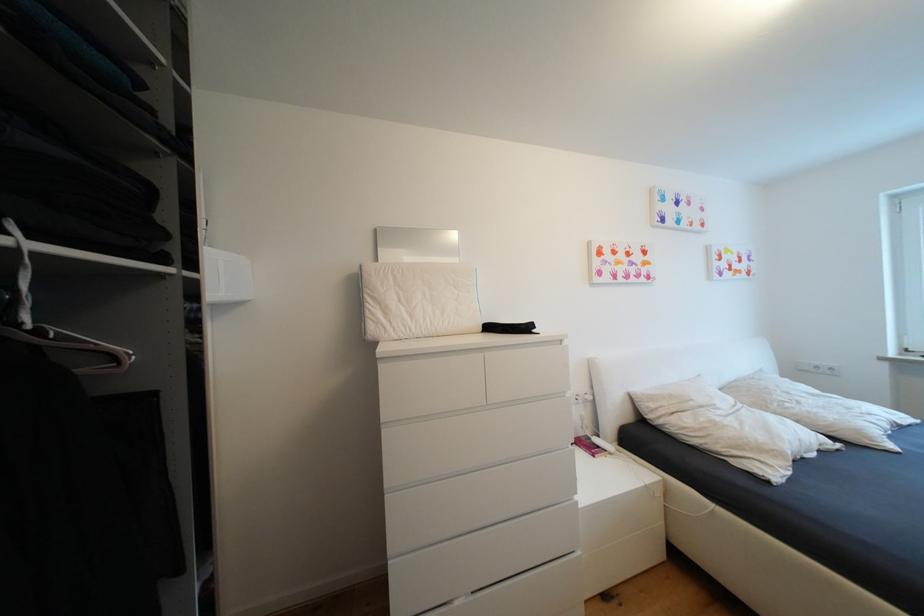
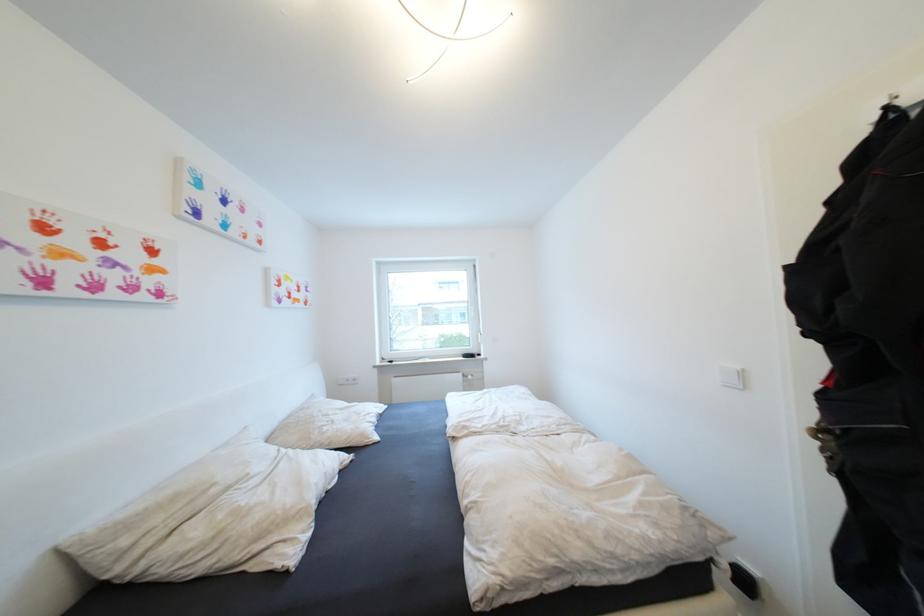
Find the pixel in the second image that matches [660,407] in the first image.

(131, 543)